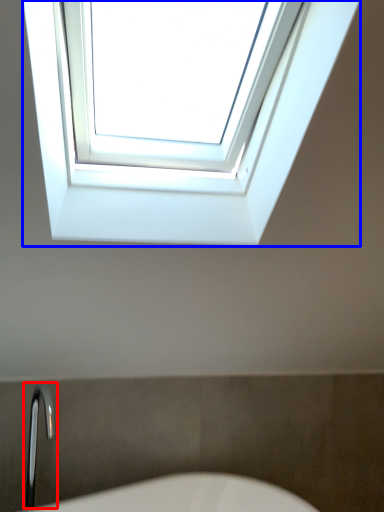
Question: Among these objects, which one is farthest to the camera, faucet (highlighted by a red box) or window (highlighted by a blue box)?

Choices:
 (A) faucet
 (B) window

Answer: (A)